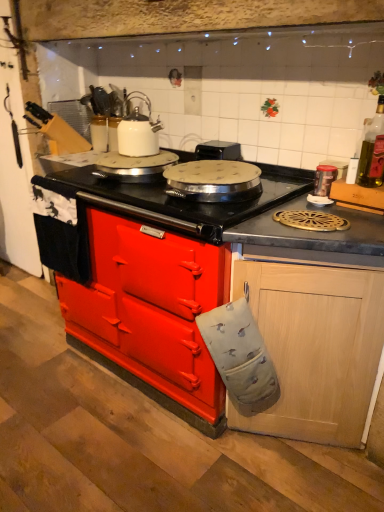
Question: Can you confirm if white glossy kettle at upper center, which appears as the first kitchen appliance when viewed from the top, is wider than metallic silver canister at upper right, placed as the second kitchen appliance when sorted from top to bottom?

Choices:
 (A) no
 (B) yes

Answer: (B)

Question: Is the depth of white glossy kettle at upper center, the 1th kitchen appliance positioned from the back, less than that of metallic silver canister at upper right, placed as the second kitchen appliance when sorted from top to bottom?

Choices:
 (A) no
 (B) yes

Answer: (A)

Question: Considering the relative sizes of white glossy kettle at upper center, the 2th kitchen appliance in the bottom-to-top sequence, and metallic silver canister at upper right, the second kitchen appliance in the left-to-right sequence, in the image provided, is white glossy kettle at upper center, the 2th kitchen appliance in the bottom-to-top sequence, shorter than metallic silver canister at upper right, the second kitchen appliance in the left-to-right sequence,?

Choices:
 (A) yes
 (B) no

Answer: (B)

Question: Can you confirm if white glossy kettle at upper center, the 1th kitchen appliance from the left, is smaller than metallic silver canister at upper right, placed as the second kitchen appliance when sorted from top to bottom?

Choices:
 (A) no
 (B) yes

Answer: (A)

Question: Is white glossy kettle at upper center, the second kitchen appliance positioned from the front, turned away from metallic silver canister at upper right, the 2th kitchen appliance from the back?

Choices:
 (A) no
 (B) yes

Answer: (A)

Question: Considering the relative sizes of white glossy kettle at upper center, the 1th kitchen appliance positioned from the back, and metallic silver canister at upper right, marked as the 1th kitchen appliance in a bottom-to-top arrangement, in the image provided, is white glossy kettle at upper center, the 1th kitchen appliance positioned from the back, taller than metallic silver canister at upper right, marked as the 1th kitchen appliance in a bottom-to-top arrangement,?

Choices:
 (A) no
 (B) yes

Answer: (B)

Question: Is black matte countertop at center taller than white glossy kettle at upper center, placed as the 2th kitchen appliance when sorted from right to left?

Choices:
 (A) yes
 (B) no

Answer: (A)

Question: Is black matte countertop at center thinner than white glossy kettle at upper center, which appears as the first kitchen appliance when viewed from the top?

Choices:
 (A) yes
 (B) no

Answer: (B)

Question: Is black matte countertop at center to the right of white glossy kettle at upper center, the 1th kitchen appliance positioned from the back, from the viewer's perspective?

Choices:
 (A) yes
 (B) no

Answer: (A)

Question: Does black matte countertop at center turn towards white glossy kettle at upper center, the 2th kitchen appliance in the bottom-to-top sequence?

Choices:
 (A) no
 (B) yes

Answer: (A)

Question: From the image's perspective, would you say black matte countertop at center is shown under white glossy kettle at upper center, the 1th kitchen appliance positioned from the back?

Choices:
 (A) yes
 (B) no

Answer: (A)

Question: From a real-world perspective, is black matte countertop at center located higher than white glossy kettle at upper center, the 1th kitchen appliance positioned from the back?

Choices:
 (A) yes
 (B) no

Answer: (B)

Question: Is black plastic toaster at upper center looking in the opposite direction of metallic silver canister at upper right, placed as the second kitchen appliance when sorted from top to bottom?

Choices:
 (A) yes
 (B) no

Answer: (B)